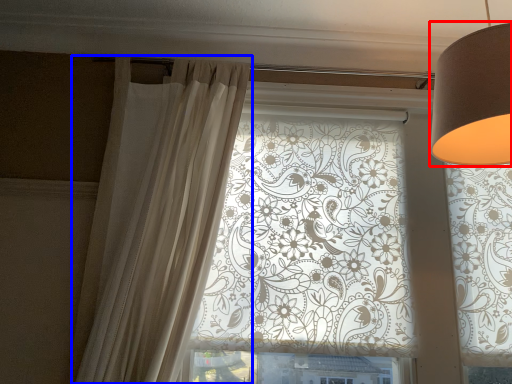
Question: Which object is closer to the camera taking this photo, lamp (highlighted by a red box) or curtain (highlighted by a blue box)?

Choices:
 (A) lamp
 (B) curtain

Answer: (A)